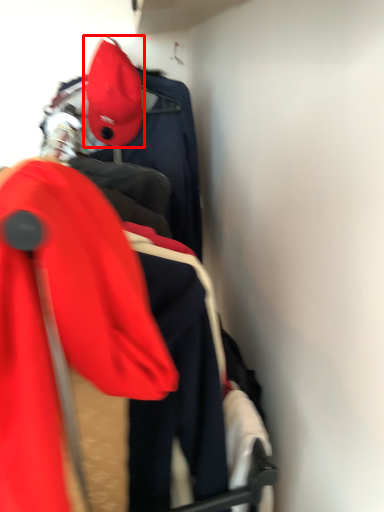
Question: Where is hat (annotated by the red box) located in relation to ski jacket in the image?

Choices:
 (A) right
 (B) left

Answer: (B)